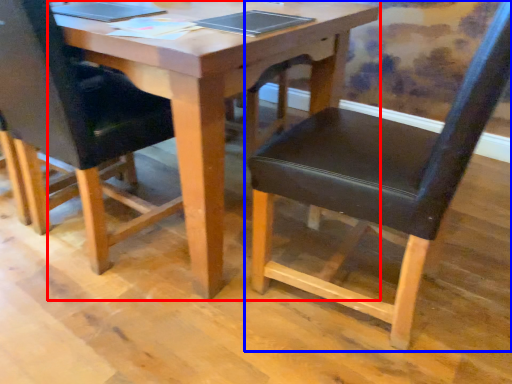
Question: Which point is further to the camera, table (highlighted by a red box) or chair (highlighted by a blue box)?

Choices:
 (A) table
 (B) chair

Answer: (A)